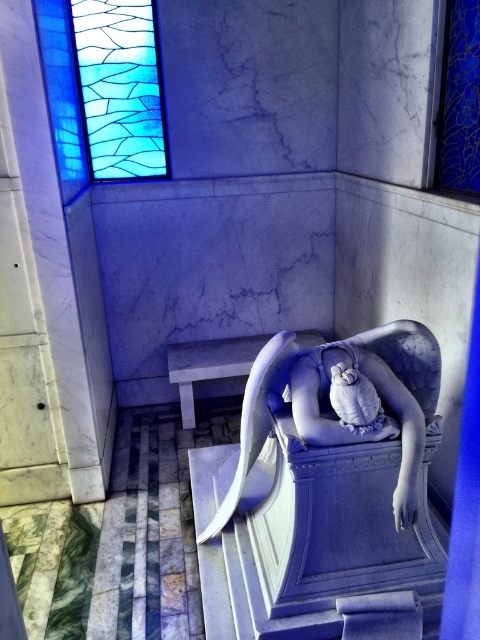
Question: Among these objects, which one is nearest to the camera?

Choices:
 (A) stained glass window at upper left
 (B) satin blue statue at center

Answer: (B)

Question: Is white marble statue at center to the left of satin blue statue at center from the viewer's perspective?

Choices:
 (A) yes
 (B) no

Answer: (A)

Question: Is satin blue statue at center bigger than stained glass window at upper left?

Choices:
 (A) yes
 (B) no

Answer: (B)

Question: Which of these objects is positioned closest to the satin blue statue at center?

Choices:
 (A) white marble statue at center
 (B) stained glass window at upper left

Answer: (A)

Question: Which of the following is the closest to the observer?

Choices:
 (A) white marble statue at center
 (B) stained glass window at upper left

Answer: (A)

Question: Can you confirm if satin blue statue at center is wider than stained glass window at upper left?

Choices:
 (A) yes
 (B) no

Answer: (A)